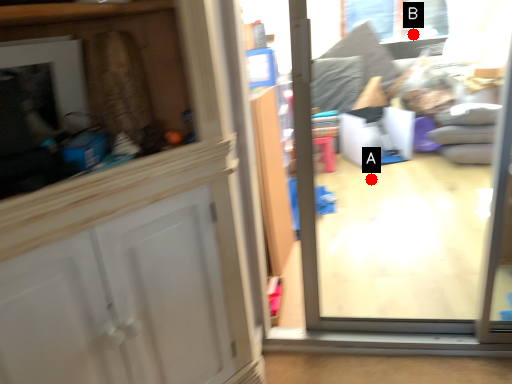
Question: Two points are circled on the image, labeled by A and B beside each circle. Among these points, which one is farthest from the camera?

Choices:
 (A) A is further
 (B) B is further

Answer: (B)